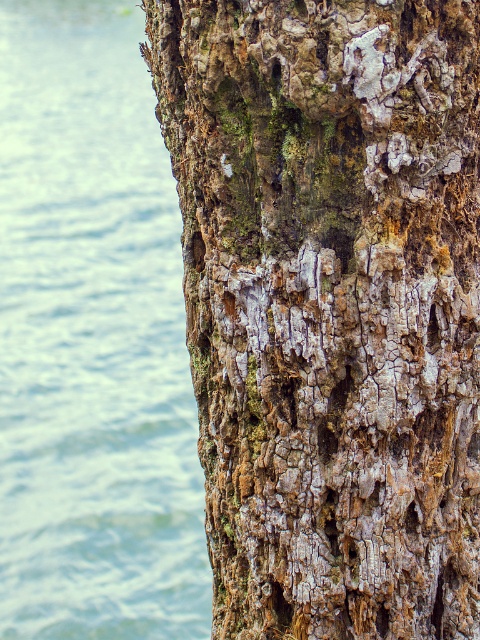
Between point (276, 483) and point (151, 396), which one is positioned in front?

Positioned in front is point (276, 483).

Who is positioned more to the left, cracked bark tree trunk at right or blue water at left?

blue water at left is more to the left.

Where is `cracked bark tree trunk at right`? cracked bark tree trunk at right is located at coordinates (330, 305).